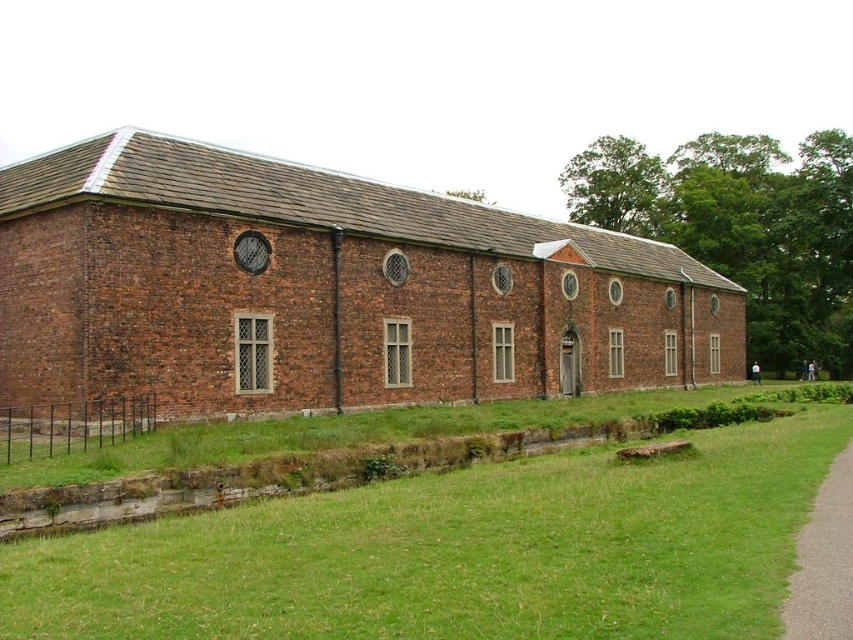
You are standing at the entrance of the brick building and need to reach the gray asphalt path at lower right. The green grass at lower center is in front of you. Can you walk directly to the path without stepping on the grass?

The green grass at lower center is 8.93 meters from gray asphalt path at lower right, so you can walk directly to the path without stepping on the grass since the distance is manageable.

You are standing at the edge of the gray asphalt path at lower right and want to walk towards the brown brick building at center. How does the width of the path compare to the building?

The brown brick building at center is wider than the gray asphalt path at lower right, so the path is narrower than the building.

You are standing at the entrance of the brick building and want to walk to the gray asphalt path at lower right. Which direction should you head to avoid the green grass at lower center?

The gray asphalt path at lower right is above the green grass at lower center, so you should head upwards to reach the gray asphalt path at lower right without stepping on the green grass at lower center.